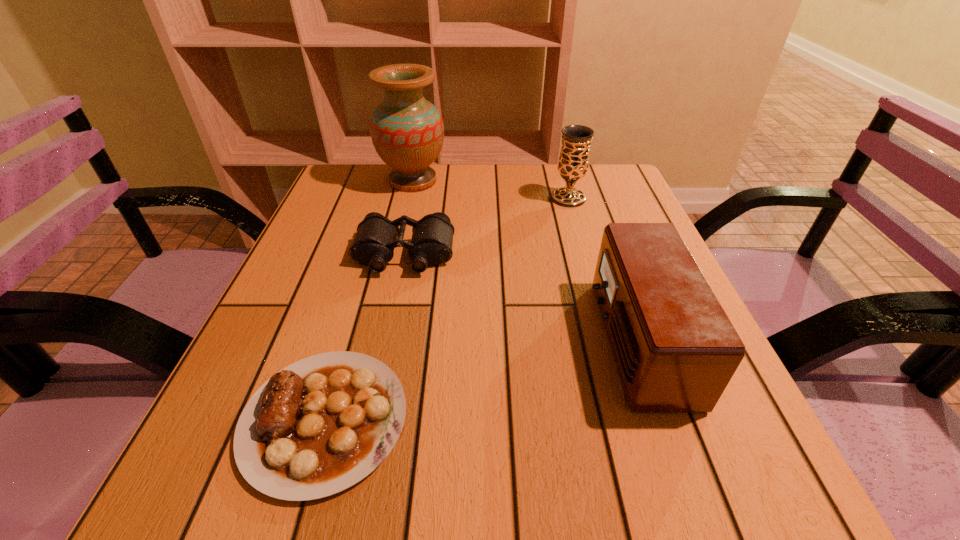
Where is `radio receiver present at the right edge`? This screenshot has height=540, width=960. radio receiver present at the right edge is located at coordinates (675, 349).

The width and height of the screenshot is (960, 540). In order to click on object that is at the far left corner in this screenshot , I will do `click(407, 131)`.

At what (x,y) coordinates should I click in order to perform the action: click on object located in the near left corner section of the desktop. Please return your answer as a coordinate pair (x, y). The height and width of the screenshot is (540, 960). Looking at the image, I should click on (322, 424).

This screenshot has height=540, width=960. What are the coordinates of `object that is at the far right corner` in the screenshot? It's located at (573, 163).

In the image, there is a desktop. At what (x,y) coordinates should I click in order to perform the action: click on vacant space at the far edge. Please return your answer as a coordinate pair (x, y). Looking at the image, I should click on (443, 175).

Locate an element on the screen. This screenshot has width=960, height=540. vacant space at the left edge of the desktop is located at coordinates (353, 229).

In the image, there is a desktop. In order to click on vacant space at the right edge in this screenshot , I will do `click(643, 221)`.

I want to click on vacant space at the far left corner of the desktop, so click(x=320, y=205).

In the image, there is a desktop. Where is `vacant space at the far right corner`? vacant space at the far right corner is located at coordinates (612, 170).

Locate an element on the screen. The image size is (960, 540). free space between the tallest object and the third shortest object is located at coordinates (525, 260).